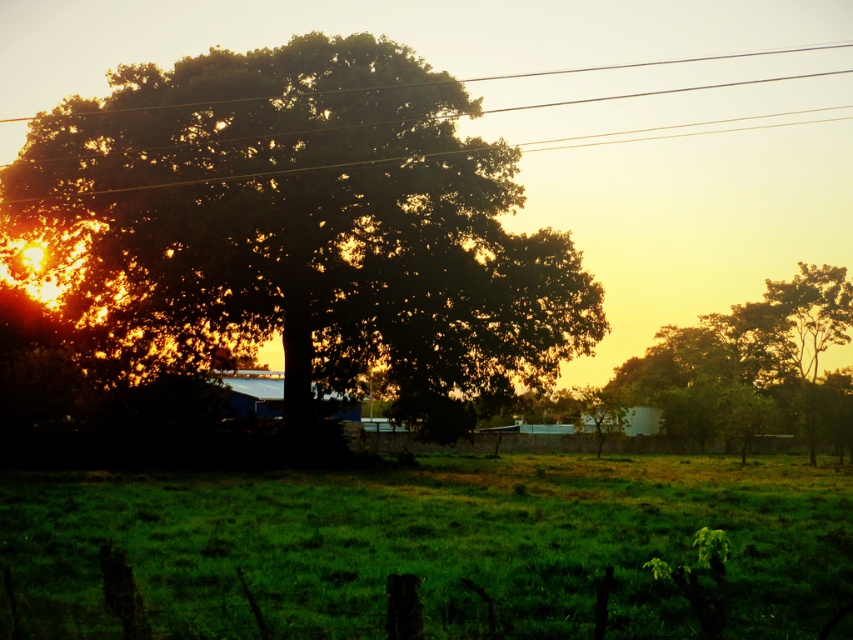
Looking at this image, you are a photographer trying to capture the green leafy tree at right and the green grassy field at center in the same frame. Which object should you position closer to the left side of your camera viewfinder to include both in the composition?

A: The green grassy field at center is positioned on the left side of green leafy tree at right, so you should position the green grassy field at center closer to the left side of your camera viewfinder to include both in the composition.

You are standing at the point closest to the viewer in the image. Which of the two points, point (438,611) or point (756,308), is closer to you?

Point (438,611) is in front of point (756,308), so it is closer to you.